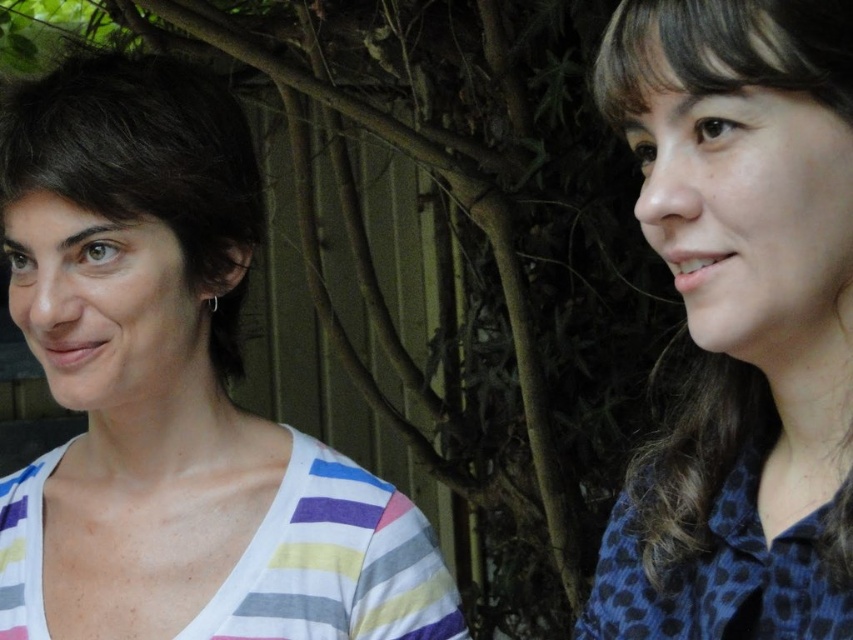
From the picture: You are a photographer trying to capture a portrait of the two people in the scene. You want to ensure that the blue dotted shirt at right and the dark brown hair at left are both visible in the frame. Based on their positions, which object is closer to the bottom of the image?

The blue dotted shirt at right is located below dark brown hair at left, so it is closer to the bottom of the image.

You are a photographer using a camera with a 50mm lens. You want to capture a portrait of both the white striped shirt at left and dark brown hair at left in the same frame. The minimum focusing distance for your camera is 3 inches. Can you position yourself close enough to both subjects to ensure they are in focus?

The distance between the white striped shirt at left and dark brown hair at left is 2.08 inches, which is less than the 3 inch minimum focusing distance. Therefore, you can position yourself close enough to both subjects to ensure they are in focus.

You are standing in a garden and see the white striped shirt at left. If you want to reach out and touch it, will you be able to do so without moving your feet?

The white striped shirt at left is 26.84 inches away from you, so yes, you can reach out and touch it without moving your feet since the distance is within typical arm length.